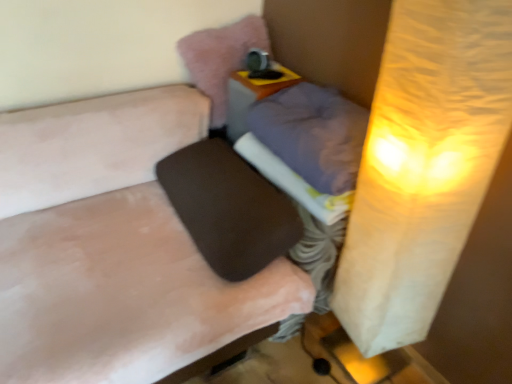
Image resolution: width=512 pixels, height=384 pixels. Identify the location of empty space that is ontop of matte plastic table at center (from a real-world perspective). (265, 74).